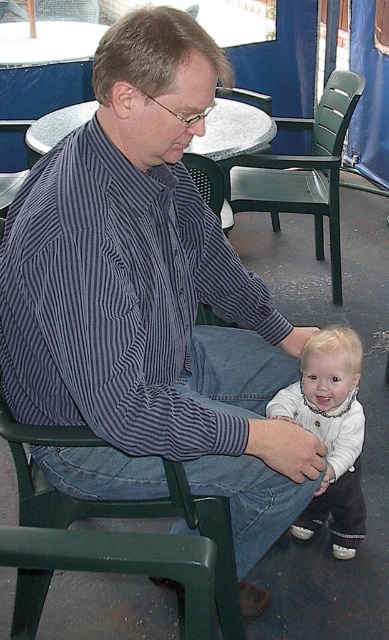
You are a photographer trying to capture a candid shot of the green plastic chair at lower left and the white soft fabric baby at lower center. To ensure both subjects are in focus, you need to know which one is taller. Can you determine which object is taller?

The white soft fabric baby at lower center is taller than the green plastic chair at lower left.

You are trying to decide where to place a large potted plant in the scene. The plant requires a spot that can accommodate its size. Which location would be more suitable for placing the plant, the green plastic chair at lower left or the green plastic chair at center?

The green plastic chair at center is more suitable because it occupies more space and can accommodate the large potted plant better than the green plastic chair at lower left, which is smaller in size.

You are a parent who wants to place your white soft fabric baby at lower center on the green plastic chair at center. Based on the scene description, will the baby fit comfortably on the chair?

The white soft fabric baby at lower center is smaller than the green plastic chair at center, so the baby will fit comfortably on the chair.